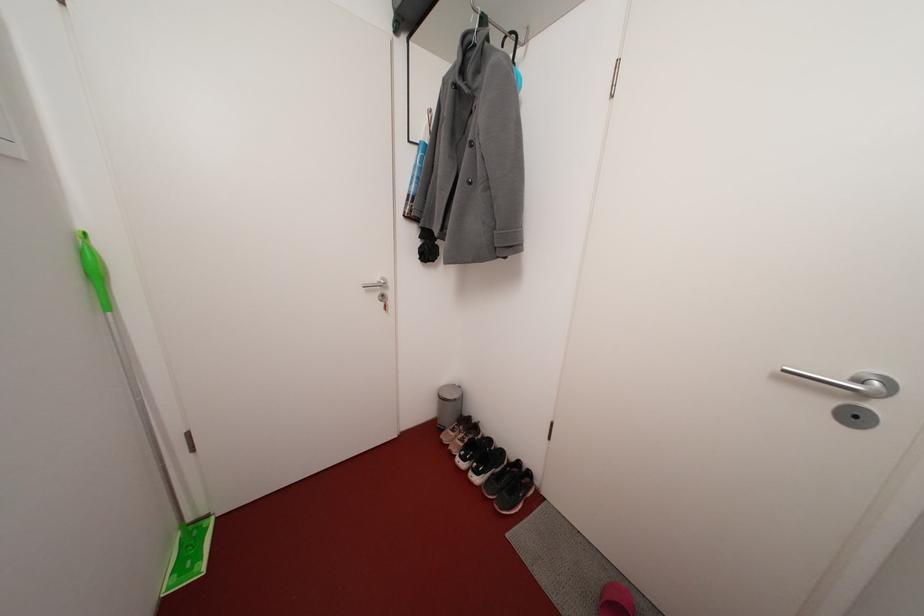
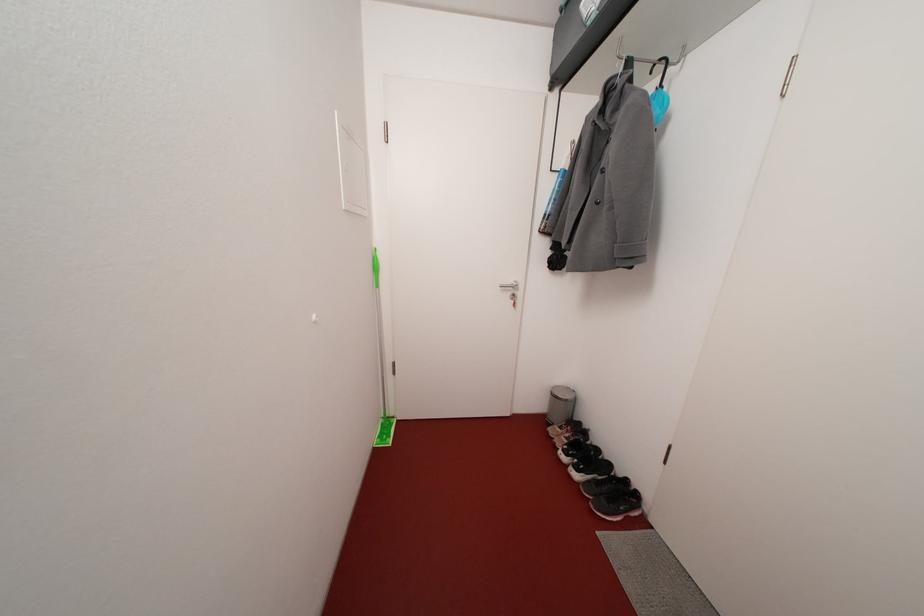
Question: I am providing you with two images of the same scene from different viewpoints. Please identify which objects are invisible in image2.

Choices:
 (A) black and white shoe
 (B) silver trash can
 (C) silver door handle
 (D) none of these

Answer: (D)